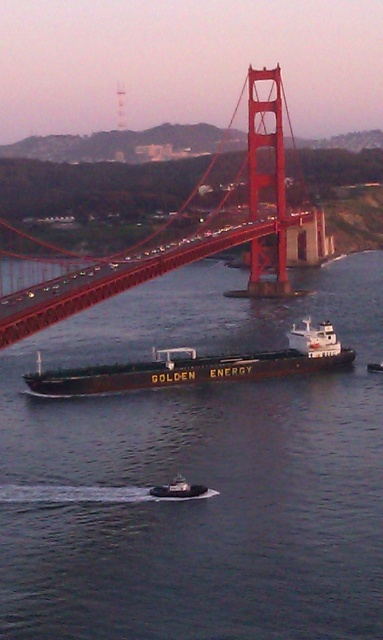
You are a photographer planning to take a photo of the brown matte water at center and the red painted steel golden gate bridge at center. Which object should you focus on first if you want to capture both in one shot without adjusting your camera focus?

The brown matte water at center is closer to the camera than the red painted steel golden gate bridge at center, so you should focus on the brown matte water at center first to ensure both are in focus.

You are a drone operator tasked with flying a drone that is 1.5 meters wide. You need to fly the drone between the brown matte water at center and the brown matte cargo ship at center. Can the drone safely pass through the space between them?

The distance between the brown matte water at center and the brown matte cargo ship at center is 21.33 meters. Since the drone is only 1.5 meters wide, it can safely pass through the space between them.

You are a photographer standing on the Golden Gate Bridge. You see the brown matte water at center and the brown matte cargo ship at center. Which object is positioned to the right of the other?

The brown matte water at center is to the right of the brown matte cargo ship at center.